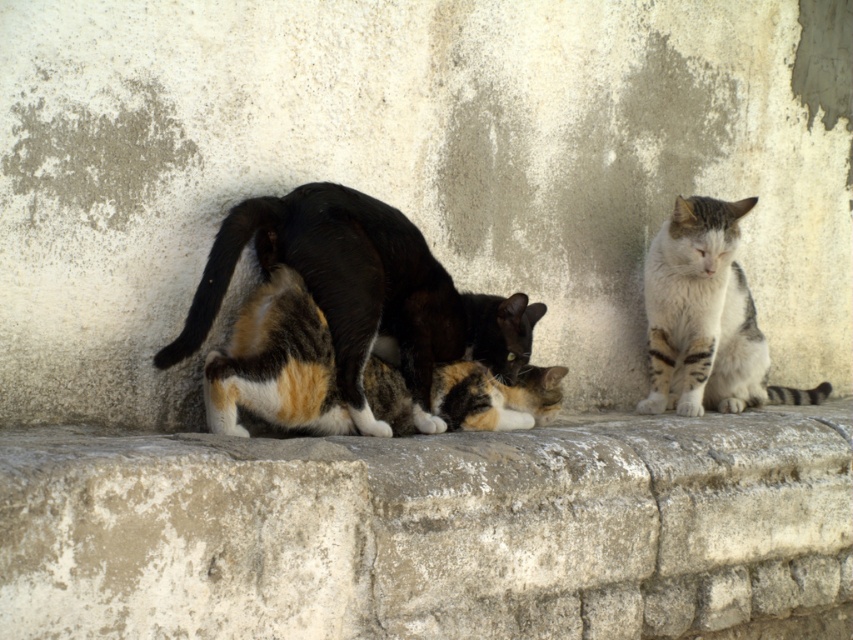
Question: Is gray stone wall at center smaller than calico fur cat at center?

Choices:
 (A) no
 (B) yes

Answer: (A)

Question: Based on their relative distances, which object is farther from the striped fur cat at right?

Choices:
 (A) gray stone wall at center
 (B) calico fur cat at center

Answer: (B)

Question: Is calico fur cat at center further to the viewer compared to striped fur cat at right?

Choices:
 (A) no
 (B) yes

Answer: (A)

Question: Which point is farther from the camera taking this photo?

Choices:
 (A) (404, 300)
 (B) (804, 509)

Answer: (B)

Question: Among these points, which one is farthest from the camera?

Choices:
 (A) (660, 234)
 (B) (436, 304)

Answer: (A)

Question: Does gray stone wall at center lie in front of calico fur cat at center?

Choices:
 (A) yes
 (B) no

Answer: (A)